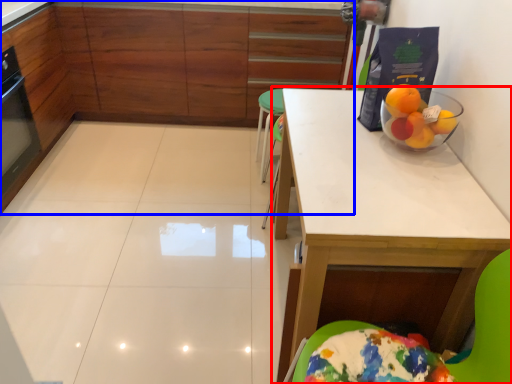
Question: Which of the following is the closest to the observer, table (highlighted by a red box) or cabinetry (highlighted by a blue box)?

Choices:
 (A) table
 (B) cabinetry

Answer: (A)